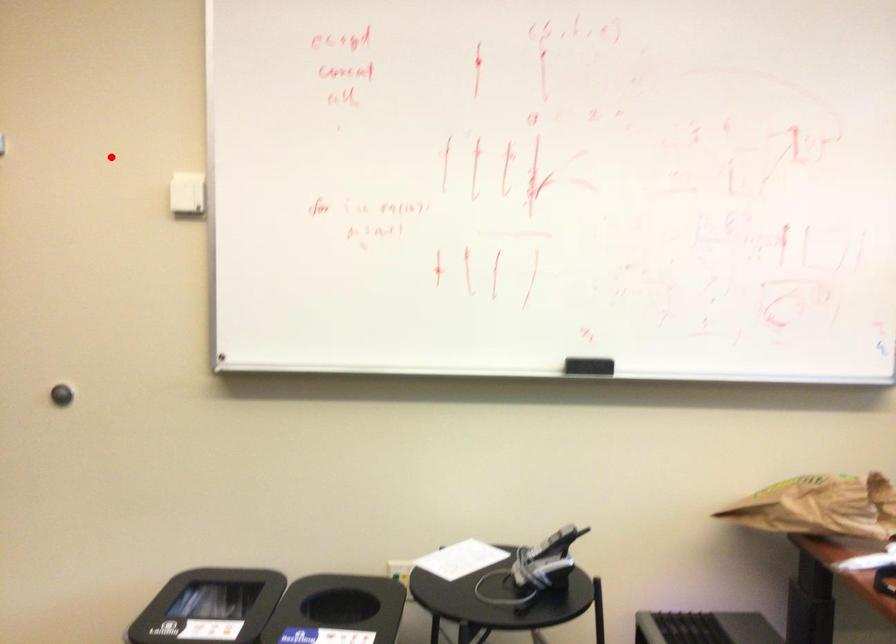
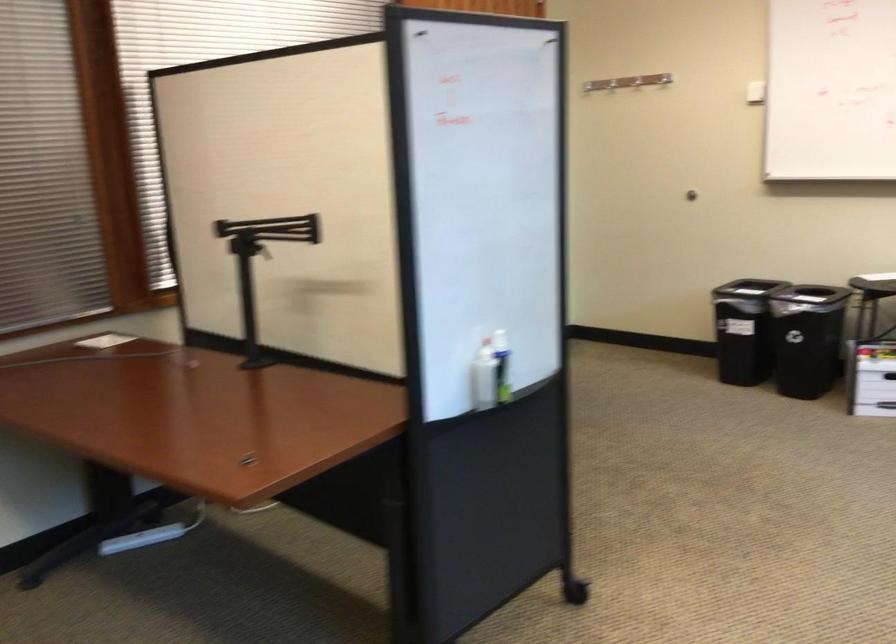
The point at the highlighted location is marked in the first image. Where is the corresponding point in the second image?

(636, 82)